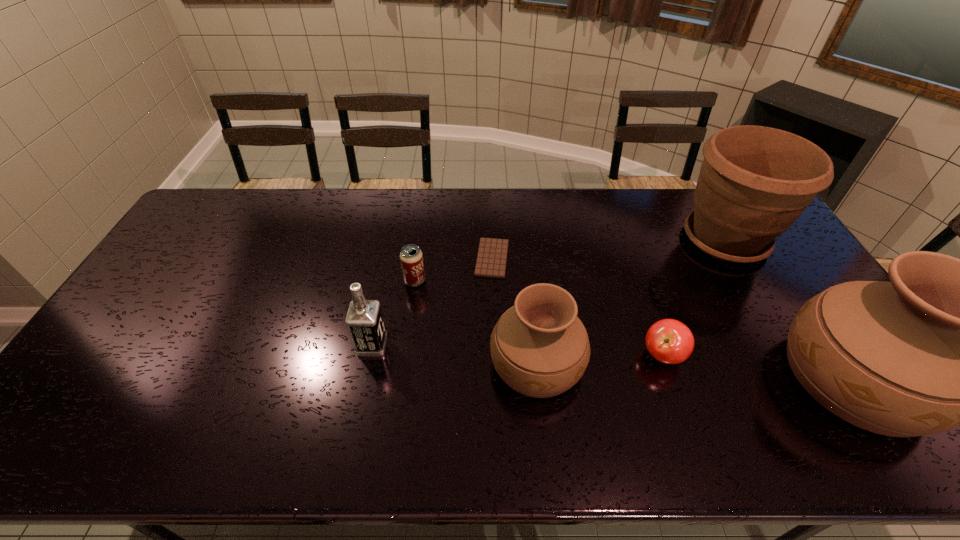
This screenshot has width=960, height=540. What are the coordinates of `free spot located 0.140m on the right of the apple` in the screenshot? It's located at (737, 355).

The height and width of the screenshot is (540, 960). Identify the location of free spot located on the front label of the vodka. (419, 345).

Locate an element on the screen. The width and height of the screenshot is (960, 540). object present at the far edge is located at coordinates (754, 182).

Find the location of a particular element. The image size is (960, 540). object located at the near edge is located at coordinates (540, 348).

Where is `object present at the right edge`? The image size is (960, 540). object present at the right edge is located at coordinates (754, 182).

In order to click on object located at the far right corner in this screenshot , I will do `click(754, 182)`.

Where is `vacant space at the far edge of the desktop`? This screenshot has height=540, width=960. vacant space at the far edge of the desktop is located at coordinates (377, 226).

In the image, there is a desktop. Where is `free region at the near edge`? Image resolution: width=960 pixels, height=540 pixels. free region at the near edge is located at coordinates (143, 401).

Where is `vacant region at the right edge of the desktop`? vacant region at the right edge of the desktop is located at coordinates (793, 256).

The image size is (960, 540). I want to click on vacant point located between the leftmost object and the beer can, so pos(394,313).